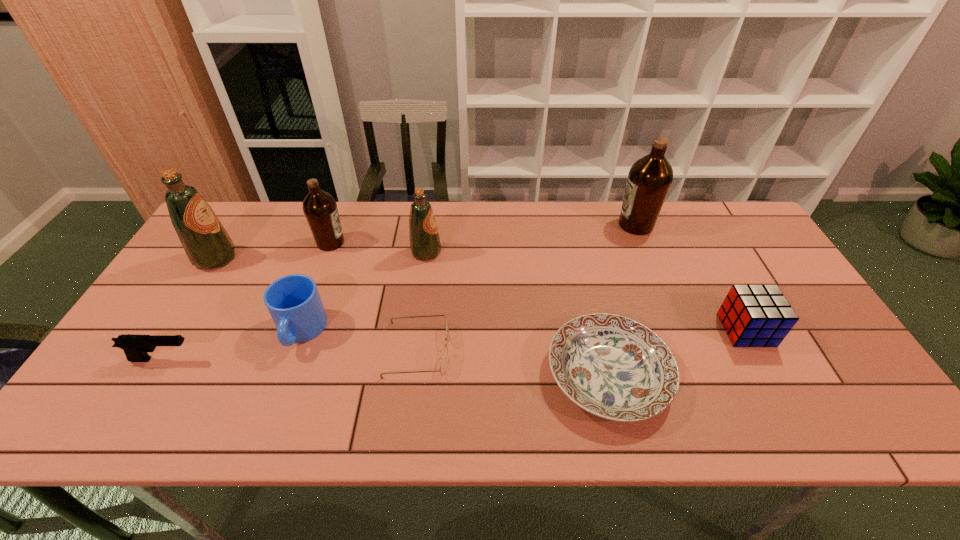
You are a GUI agent. You are given a task and a screenshot of the screen. Output one action in this format:
    pyautogui.click(x=<x>, y=<y>)
    Task: Click on the free location that satisfies the following two spatial constraints: 1. on the front side of the rightmost object; 2. on the front-facing side of the seventh tallest object
    Image resolution: width=960 pixels, height=540 pixels.
    Given the screenshot: What is the action you would take?
    pyautogui.click(x=762, y=360)

Where is `free space that satisfies the following two spatial constraints: 1. on the front-facing side of the pistol; 2. on the left side of the plate`? This screenshot has height=540, width=960. free space that satisfies the following two spatial constraints: 1. on the front-facing side of the pistol; 2. on the left side of the plate is located at coordinates (154, 374).